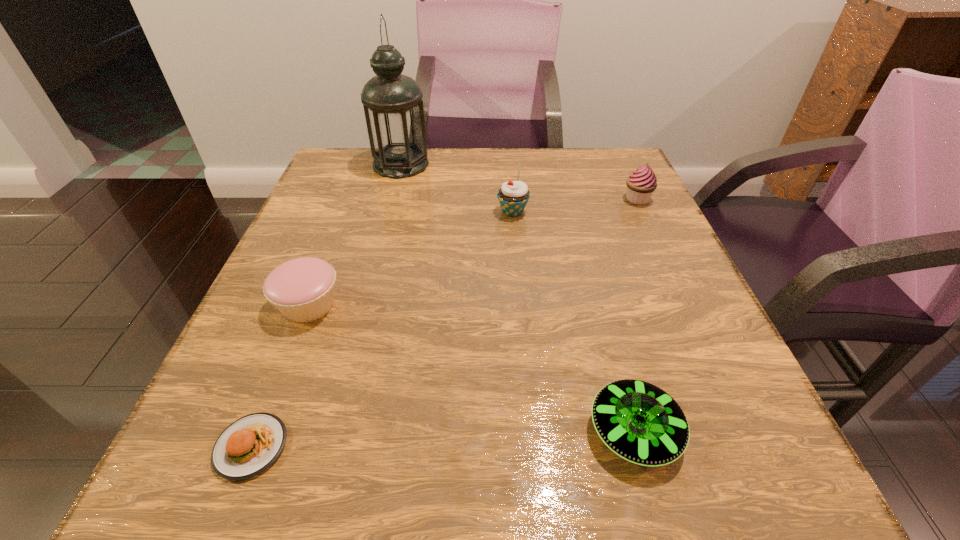
Where is `free space located on the left of the second cupcake from left to right`? free space located on the left of the second cupcake from left to right is located at coordinates (346, 212).

Locate an element on the screen. This screenshot has width=960, height=540. free space located on the front of the rightmost cupcake is located at coordinates (676, 281).

Locate an element on the screen. This screenshot has width=960, height=540. free region located 0.240m on the right of the third nearest object is located at coordinates (481, 305).

Identify the location of free space located 0.360m on the back of the fifth object from left to right. (582, 238).

Where is `free spot located 0.130m on the back of the food`? free spot located 0.130m on the back of the food is located at coordinates pyautogui.click(x=293, y=341).

The width and height of the screenshot is (960, 540). Identify the location of oil lamp at the far edge. (393, 106).

The image size is (960, 540). Identify the location of cupcake that is at the far edge. (642, 183).

Locate an element on the screen. The image size is (960, 540). saucer located in the near edge section of the desktop is located at coordinates (640, 422).

Locate an element on the screen. This screenshot has height=540, width=960. food situated at the near edge is located at coordinates (248, 446).

Locate an element on the screen. The width and height of the screenshot is (960, 540). oil lamp located in the left edge section of the desktop is located at coordinates (393, 106).